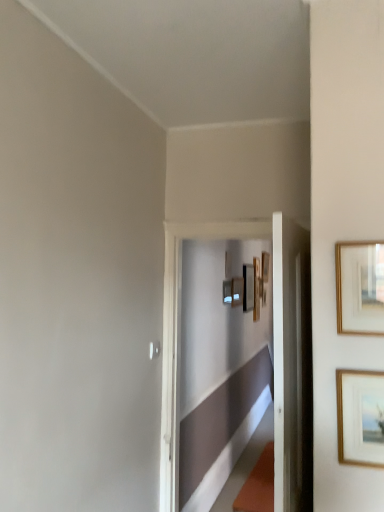
Question: From a real-world perspective, is matte black picture frame at center, which is counted as the 4th picture frame, starting from the back, on top of wooden picture frame at center, which appears as the third picture frame when viewed from the back?

Choices:
 (A) no
 (B) yes

Answer: (A)

Question: Can you confirm if matte black picture frame at center, which is the third picture frame from front to back, is thinner than wooden picture frame at center, the fourth picture frame when ordered from front to back?

Choices:
 (A) yes
 (B) no

Answer: (A)

Question: Considering the relative positions of matte black picture frame at center, which is the third picture frame from front to back, and wooden picture frame at center, which appears as the third picture frame when viewed from the back, in the image provided, is matte black picture frame at center, which is the third picture frame from front to back, to the left of wooden picture frame at center, which appears as the third picture frame when viewed from the back, from the viewer's perspective?

Choices:
 (A) yes
 (B) no

Answer: (A)

Question: Considering the relative sizes of matte black picture frame at center, which is the third picture frame from front to back, and wooden picture frame at center, which appears as the third picture frame when viewed from the back, in the image provided, is matte black picture frame at center, which is the third picture frame from front to back, shorter than wooden picture frame at center, which appears as the third picture frame when viewed from the back,?

Choices:
 (A) no
 (B) yes

Answer: (B)

Question: From the image's perspective, is matte black picture frame at center, which is the third picture frame from front to back, located beneath wooden picture frame at center, which appears as the third picture frame when viewed from the back?

Choices:
 (A) yes
 (B) no

Answer: (B)

Question: From a real-world perspective, is matte black picture frame at center, which appears as the 5th picture frame when viewed from the front, positioned above or below wooden picture frame at center, which ranks as the 1th picture frame in back-to-front order?

Choices:
 (A) above
 (B) below

Answer: (A)

Question: Is point (249, 290) positioned closer to the camera than point (256, 305)?

Choices:
 (A) closer
 (B) farther

Answer: (A)

Question: In terms of width, does matte black picture frame at center, which appears as the 5th picture frame when viewed from the front, look wider or thinner when compared to wooden picture frame at center, which ranks as the 1th picture frame in back-to-front order?

Choices:
 (A) wide
 (B) thin

Answer: (B)

Question: Is matte black picture frame at center, which appears as the 5th picture frame when viewed from the front, situated inside wooden picture frame at center, which ranks as the 1th picture frame in back-to-front order, or outside?

Choices:
 (A) outside
 (B) inside

Answer: (A)

Question: Is point (243, 267) closer or farther from the camera than point (350, 449)?

Choices:
 (A) farther
 (B) closer

Answer: (A)

Question: Is matte black picture frame at center, the second picture frame when ordered from back to front, inside the boundaries of gold-framed picture at right, the first picture frame when ordered from front to back, or outside?

Choices:
 (A) outside
 (B) inside

Answer: (A)

Question: From the image's perspective, is matte black picture frame at center, which appears as the 5th picture frame when viewed from the front, positioned above or below gold-framed picture at right, the 6th picture frame from the back?

Choices:
 (A) below
 (B) above

Answer: (B)

Question: From their relative heights in the image, would you say matte black picture frame at center, which appears as the 5th picture frame when viewed from the front, is taller or shorter than gold-framed picture at right, the first picture frame when ordered from front to back?

Choices:
 (A) tall
 (B) short

Answer: (A)

Question: From a real-world perspective, is gold-framed picture at right, the first picture frame when ordered from front to back, physically located above or below wooden picture frame at center, which appears as the third picture frame when viewed from the back?

Choices:
 (A) below
 (B) above

Answer: (A)

Question: From the image's perspective, is gold-framed picture at right, the first picture frame when ordered from front to back, located above or below wooden picture frame at center, the fourth picture frame when ordered from front to back?

Choices:
 (A) above
 (B) below

Answer: (B)